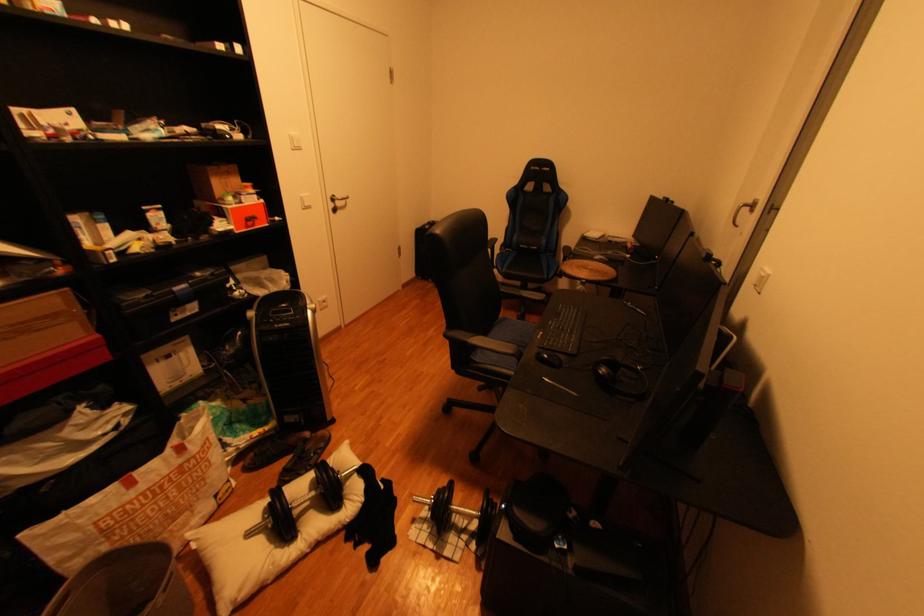
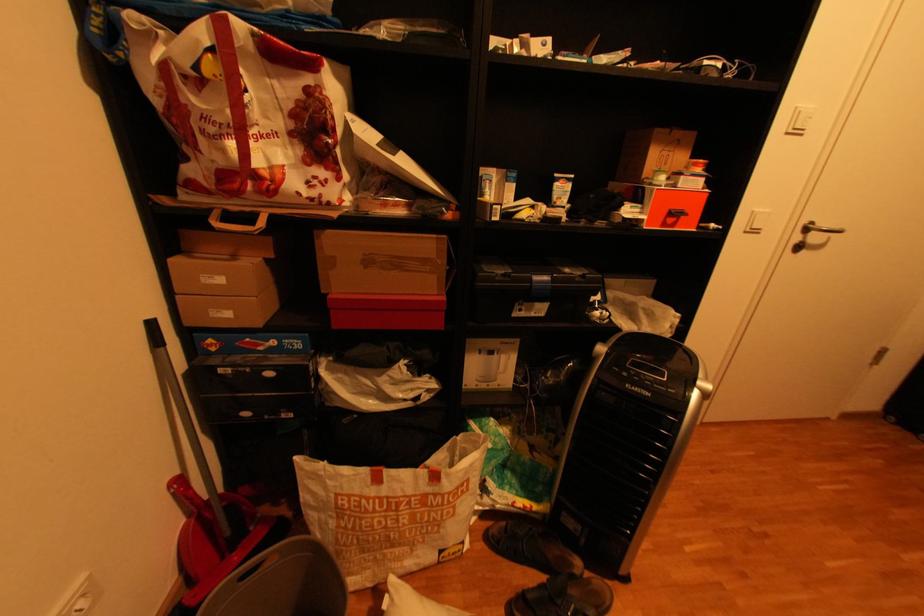
Question: I am providing you with two images of the same scene from different viewpoints. Please identify which objects are invisible in image2.

Choices:
 (A) small orange-capped bottle
 (B) white light switch
 (C) small cardboard box
 (D) none of these

Answer: (D)